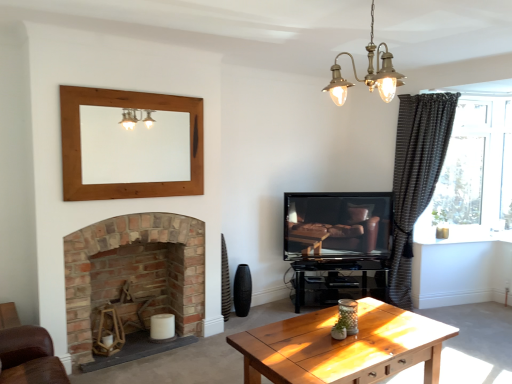
Question: Considering the positions of brass/textured chandelier at upper center and wooden mirror at upper center in the image, is brass/textured chandelier at upper center taller or shorter than wooden mirror at upper center?

Choices:
 (A) short
 (B) tall

Answer: (A)

Question: From the image's perspective, is brass/textured chandelier at upper center above or below wooden mirror at upper center?

Choices:
 (A) above
 (B) below

Answer: (A)

Question: Which object is the farthest from the clear glass window at right?

Choices:
 (A) brass/textured chandelier at upper center
 (B) wooden mirror at upper center
 (C) matte black tv at center
 (D) brick fireplace at lower left
 (E) dark grey textured curtain at right

Answer: (D)

Question: Estimate the real-world distances between objects in this image. Which object is farther from the dark grey textured curtain at right?

Choices:
 (A) brick fireplace at lower left
 (B) matte black tv at center
 (C) brass/textured chandelier at upper center
 (D) clear glass window at right
 (E) wooden mirror at upper center

Answer: (E)